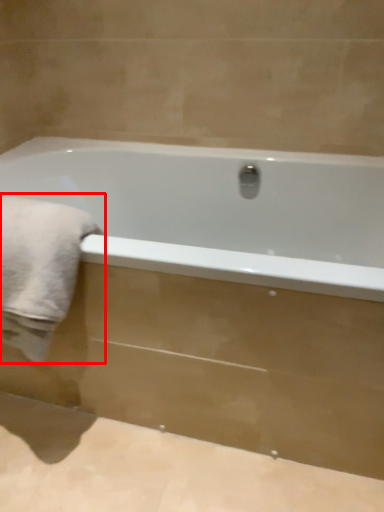
Question: From the image's perspective, considering the relative positions of bath towel (annotated by the red box) and bathtub in the image provided, where is bath towel (annotated by the red box) located with respect to the staircase?

Choices:
 (A) below
 (B) above

Answer: (B)